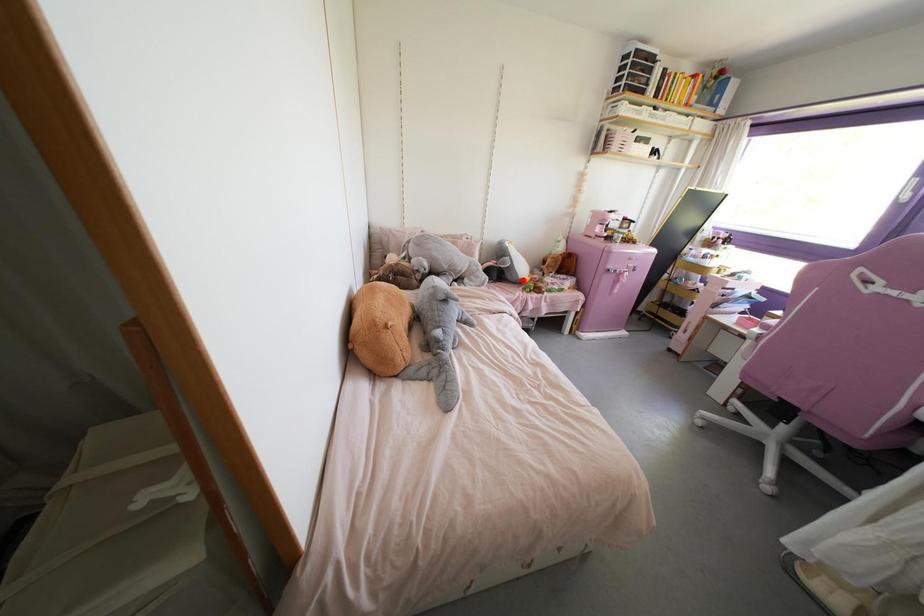
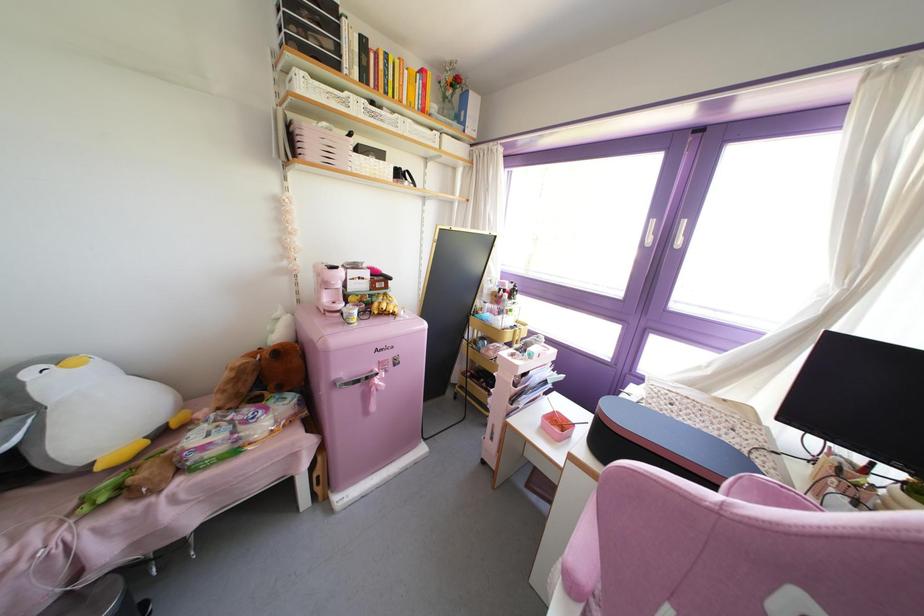
Where in the second image is the point corresponding to the highlighted location from the first image?

(99, 467)